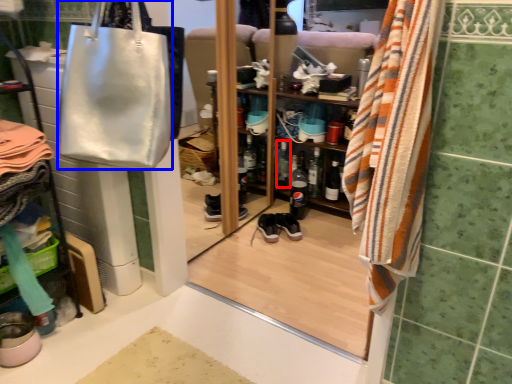
Question: Which of the following is the farthest to the observer, bottle (highlighted by a red box) or handbag (highlighted by a blue box)?

Choices:
 (A) bottle
 (B) handbag

Answer: (A)